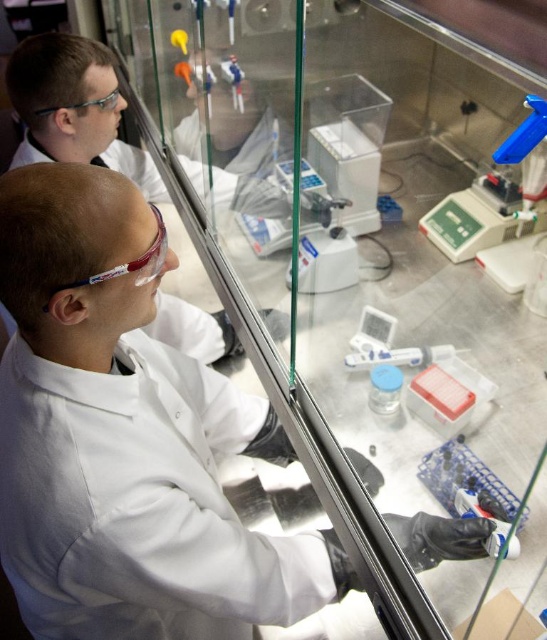
You are a new intern in the lab and need to locate safety equipment. According to the image, where is the transparent plastic goggles at upper left positioned relative to the fume hood?

The transparent plastic goggles at upper left is located at point (131, 262) relative to the fume hood.

You are a safety inspector and need to ensure proper equipment placement in the lab. According to the image, how far apart are the white lab coat at upper left and the transparent plastic goggles at upper left?

The white lab coat at upper left is 30.36 inches from the transparent plastic goggles at upper left, so they are placed approximately 30.36 inches apart.